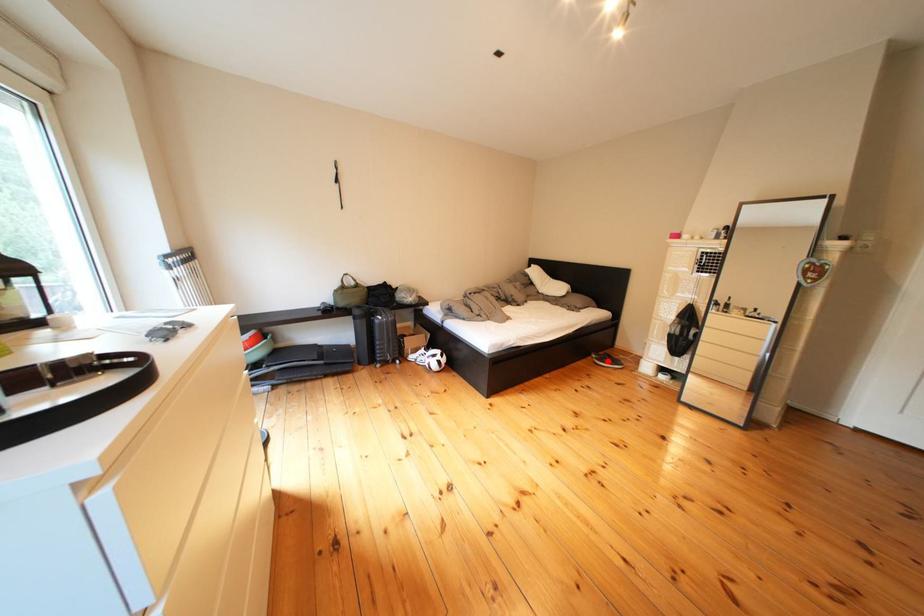
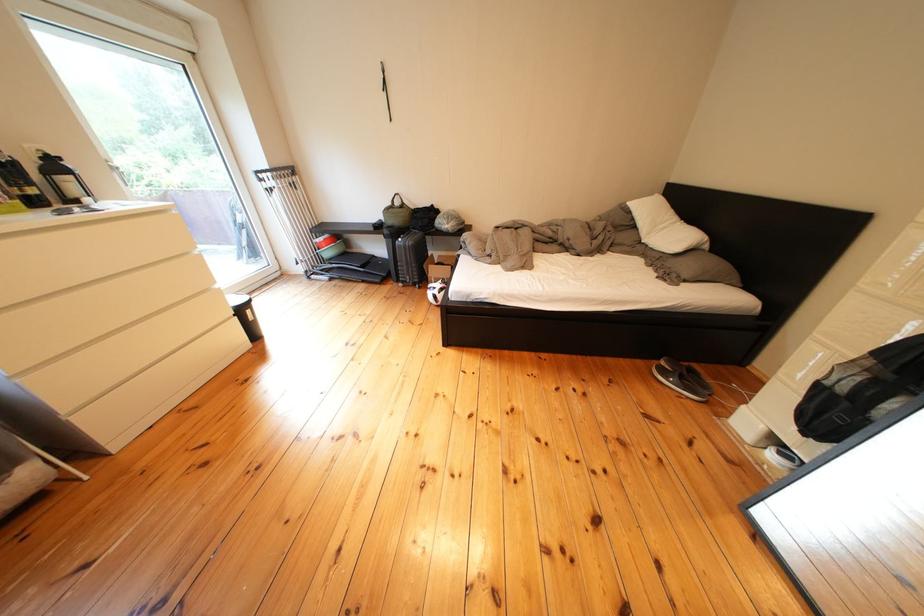
Question: I am providing you with two images of the same scene from different viewpoints. A red point is marked on the first image. Can you still see the location of the red point in image 2?

Choices:
 (A) Yes
 (B) No

Answer: (A)